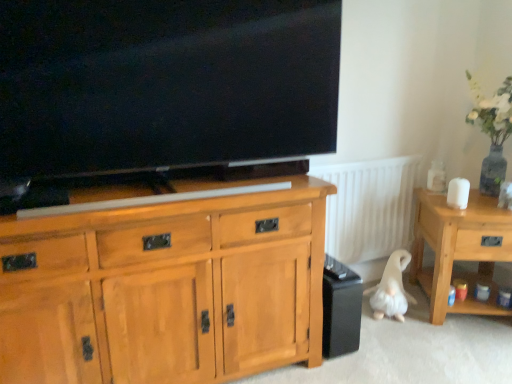
Where is `free location in front of white plush dog at lower right`? The height and width of the screenshot is (384, 512). free location in front of white plush dog at lower right is located at coordinates (402, 336).